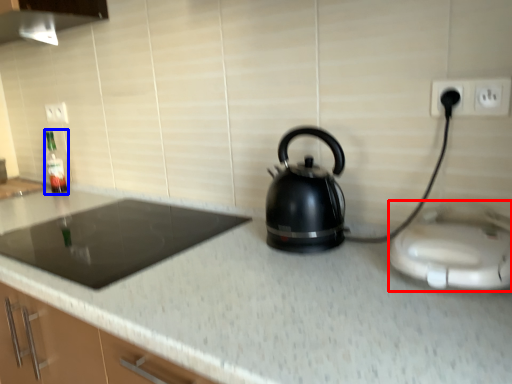
Question: Among these objects, which one is farthest to the camera, appliance (highlighted by a red box) or bottle (highlighted by a blue box)?

Choices:
 (A) appliance
 (B) bottle

Answer: (B)